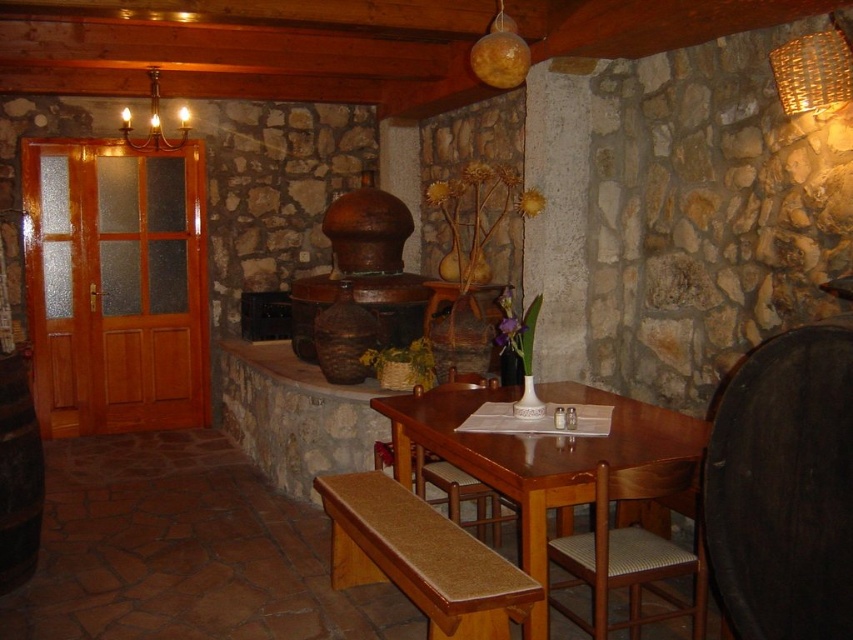
You are a painter standing in the dining area and need to hang a painting that is 1.5 meters wide. You want to place it between the wooden chair with woven seat at lower right and the wooden chandelier at upper left. Is there enough space between them for the painting?

The wooden chair with woven seat at lower right and wooden chandelier at upper left are 4.03 meters apart, so yes, there is enough space between them for the 1.5 meters wide painting.

You are planning to seat guests in this dining area. The brown textured bench at lower center and the wooden chair with woven seat at lower right are available. If you want to accommodate more people, which furniture should you choose?

The brown textured bench at lower center is larger in size than the wooden chair with woven seat at lower right, so it can accommodate more people.